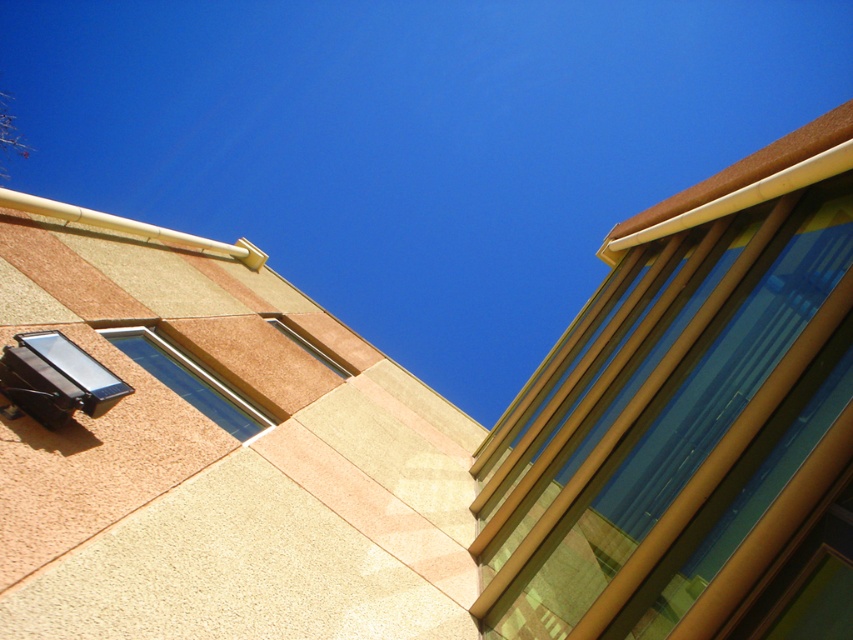
Does black plastic window at lower left have a larger size compared to metallic silver window at upper center?

Actually, black plastic window at lower left might be smaller than metallic silver window at upper center.

Between black plastic window at lower left and metallic silver window at upper center, which one has less height?

Standing shorter between the two is black plastic window at lower left.

Measure the distance between black plastic window at lower left and camera.

black plastic window at lower left is 4.49 meters away from camera.

Where is `black plastic window at lower left`? black plastic window at lower left is located at coordinates (77, 369).

Can you confirm if clear glass window at upper left is shorter than metallic silver window at upper center?

Incorrect, clear glass window at upper left's height does not fall short of metallic silver window at upper center's.

Can you confirm if clear glass window at upper left is positioned above metallic silver window at upper center?

No.

Who is more forward, (216, 387) or (270, 320)?

Point (216, 387) is in front.

Locate an element on the screen. The width and height of the screenshot is (853, 640). clear glass window at upper left is located at coordinates (189, 380).

Identify the location of matte gold window at upper right. (672, 420).

Can you confirm if matte gold window at upper right is positioned below metallic silver window at upper center?

Incorrect, matte gold window at upper right is not positioned below metallic silver window at upper center.

Between point (633, 468) and point (280, 330), which one is positioned behind?

Positioned behind is point (280, 330).

This screenshot has height=640, width=853. Identify the location of matte gold window at upper right. [672, 420].